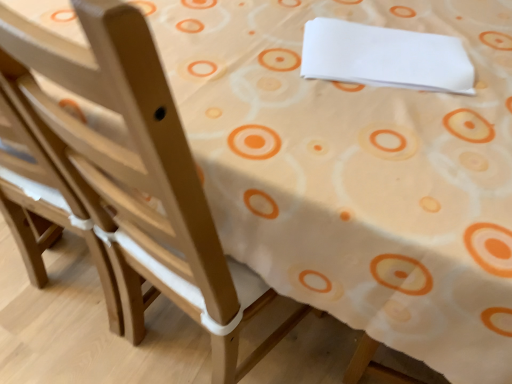
Question: From a real-world perspective, is light wood chair at left above or below white paper at upper right?

Choices:
 (A) below
 (B) above

Answer: (A)

Question: In the image, is light wood chair at left positioned in front of or behind white paper at upper right?

Choices:
 (A) front
 (B) behind

Answer: (A)

Question: Considering the positions of light wood chair at left and white paper at upper right in the image, is light wood chair at left taller or shorter than white paper at upper right?

Choices:
 (A) short
 (B) tall

Answer: (B)

Question: Considering the positions of point (382, 33) and point (152, 97), is point (382, 33) closer or farther from the camera than point (152, 97)?

Choices:
 (A) farther
 (B) closer

Answer: (A)

Question: In terms of height, does white paper at upper right look taller or shorter compared to light wood chair at left?

Choices:
 (A) short
 (B) tall

Answer: (A)

Question: In the image, is white paper at upper right positioned in front of or behind light wood chair at left?

Choices:
 (A) front
 (B) behind

Answer: (B)

Question: Is white paper at upper right bigger or smaller than light wood chair at left?

Choices:
 (A) small
 (B) big

Answer: (A)